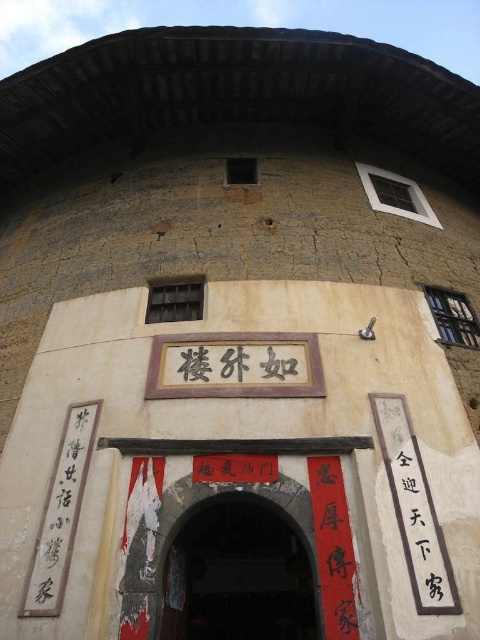
Can you confirm if black wood sign at center is smaller than black calligraphy at right?

Incorrect, black wood sign at center is not smaller in size than black calligraphy at right.

Does black wood sign at center have a greater height compared to black calligraphy at right?

No.

Between point (171, 348) and point (423, 584), which one is positioned behind?

The point (171, 348) is more distant.

The image size is (480, 640). Find the location of `black wood sign at center`. black wood sign at center is located at coordinates (235, 365).

Between dark brown wooden door at center and black wood sign at center, which one has more height?

Standing taller between the two is dark brown wooden door at center.

Between dark brown wooden door at center and black wood sign at center, which one is positioned lower?

dark brown wooden door at center is below.

Does point (215, 634) lie in front of point (275, 358)?

No.

Where is `dark brown wooden door at center`? This screenshot has height=640, width=480. dark brown wooden door at center is located at coordinates (238, 573).

Does dark brown wooden door at center have a greater width compared to black calligraphy at right?

Indeed, dark brown wooden door at center has a greater width compared to black calligraphy at right.

Can you confirm if dark brown wooden door at center is smaller than black calligraphy at right?

Incorrect, dark brown wooden door at center is not smaller in size than black calligraphy at right.

Is point (197, 524) farther from viewer compared to point (404, 451)?

Yes, it is behind point (404, 451).

The image size is (480, 640). I want to click on dark brown wooden door at center, so click(x=238, y=573).